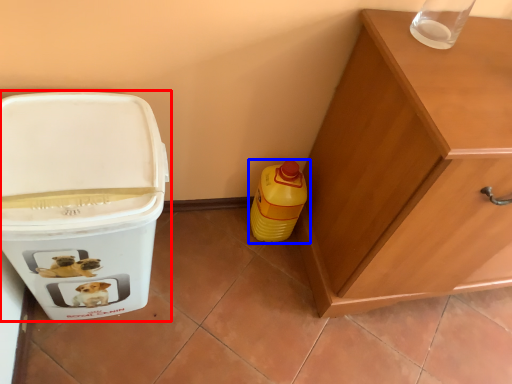
Question: Which point is closer to the camera, waste container (highlighted by a red box) or bottle (highlighted by a blue box)?

Choices:
 (A) waste container
 (B) bottle

Answer: (A)